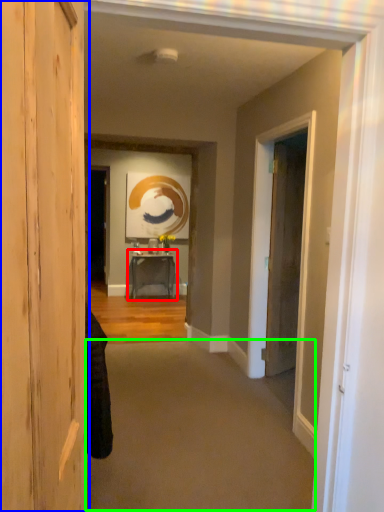
Question: Which object is the closest to the table (highlighted by a red box)? Choose among these: door (highlighted by a blue box) or plain (highlighted by a green box).

Choices:
 (A) door
 (B) plain

Answer: (B)